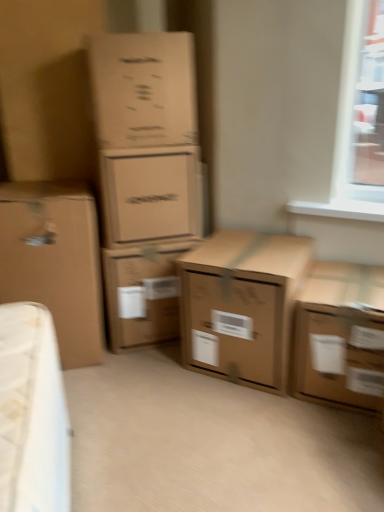
Where is `free space in front of brown cardboard box at center, the third box positioned from the right`? Image resolution: width=384 pixels, height=512 pixels. free space in front of brown cardboard box at center, the third box positioned from the right is located at coordinates (142, 378).